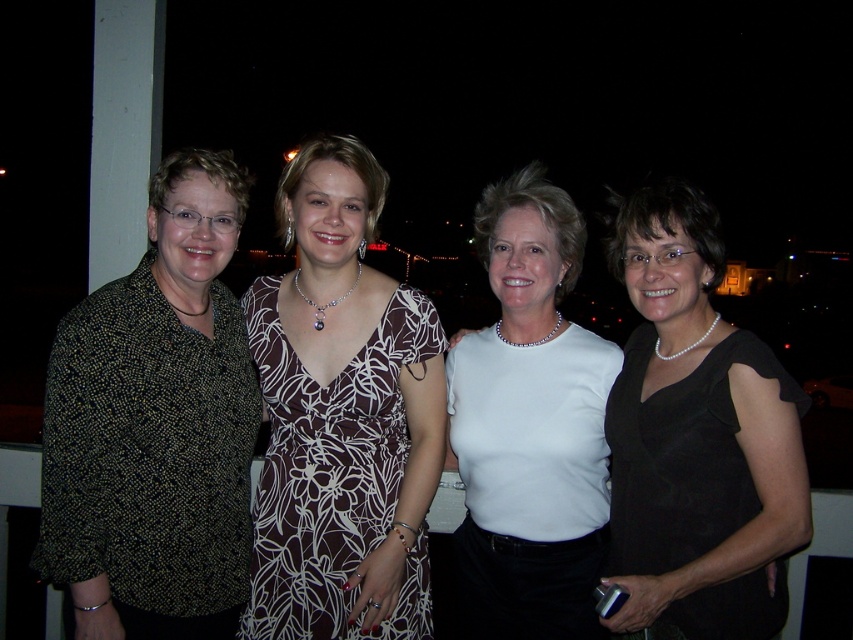
You are a photographer setting up for a group photo. You notice the white satin blouse at center and the black satin dress at right. Which clothing item appears taller in the photo?

The white satin blouse at center appears taller than the black satin dress at right.

You are a photographer trying to adjust the lighting for a group photo. You notice two central items in the frame that might affect the light reflection. Which of the two, the white satin blouse at center or the brown floral dress at center, will reflect more light?

The white satin blouse at center will reflect more light because it is bigger than the brown floral dress at center.

You are a photographer adjusting your camera settings to focus on two specific points in the image. The first point is at coordinate point (84, 442) and the second is at point (762, 595). Since you can only focus on one point at a time, which point should you choose to ensure the foreground subject is sharp?

Point (84, 442) is further to the viewer than point (762, 595), so you should focus on point (84, 442) to keep the foreground subject sharp.